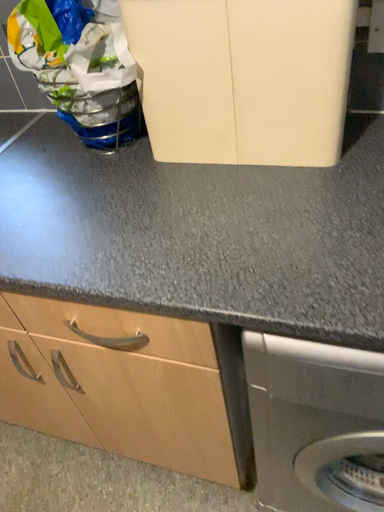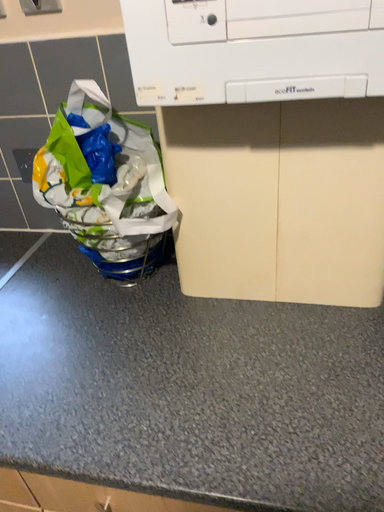
Question: Which way did the camera rotate in the video?

Choices:
 (A) rotated upward
 (B) rotated downward

Answer: (A)